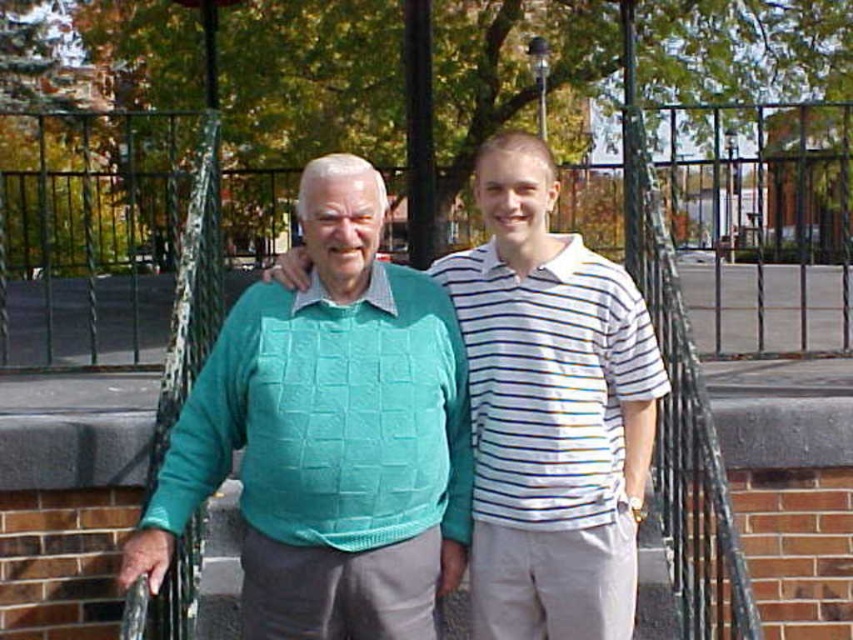
Question: Which object is farther from the camera taking this photo?

Choices:
 (A) white striped polo shirt at center
 (B) green wire fence at center

Answer: (B)

Question: Does green wire fence at center come behind white striped polo shirt at center?

Choices:
 (A) no
 (B) yes

Answer: (B)

Question: Estimate the real-world distances between objects in this image. Which object is closer to the white striped polo shirt at center?

Choices:
 (A) teal knitted sweater at center
 (B) green wire fence at center

Answer: (A)

Question: Does teal knitted sweater at center have a greater width compared to white striped polo shirt at center?

Choices:
 (A) no
 (B) yes

Answer: (B)

Question: Does green wire fence at center have a lesser width compared to white striped polo shirt at center?

Choices:
 (A) yes
 (B) no

Answer: (B)

Question: Which object is positioned farthest from the white striped polo shirt at center?

Choices:
 (A) teal knitted sweater at center
 (B) green wire fence at center

Answer: (B)